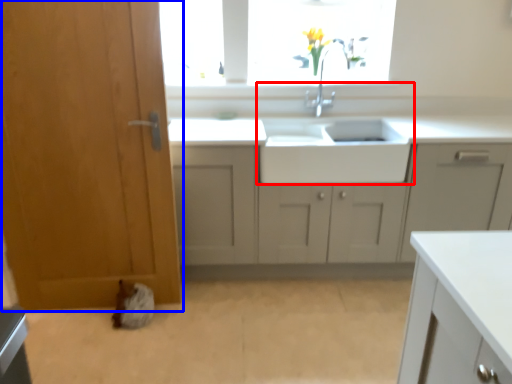
Question: Which object is further to the camera taking this photo, sink (highlighted by a red box) or door (highlighted by a blue box)?

Choices:
 (A) sink
 (B) door

Answer: (A)